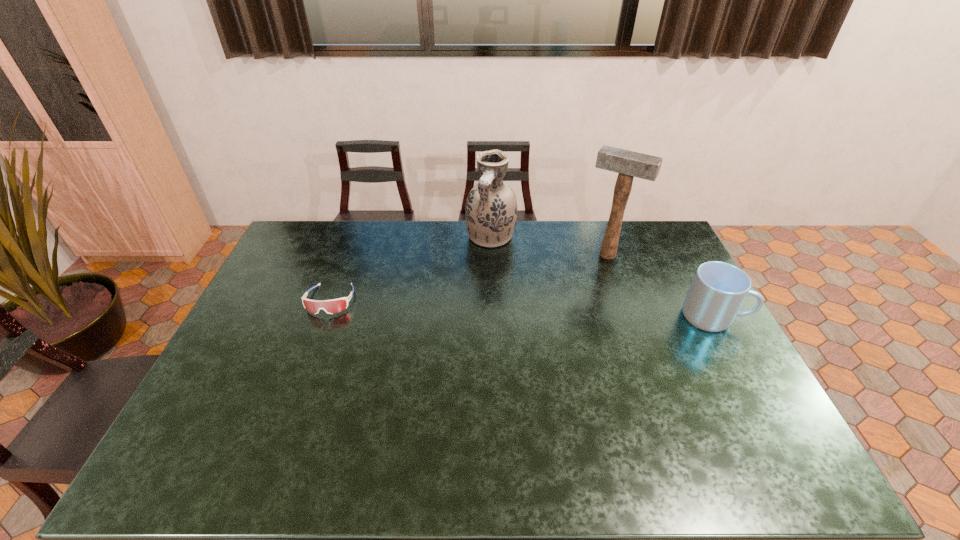
Find the location of a particular element. The height and width of the screenshot is (540, 960). the shortest object is located at coordinates [333, 306].

The image size is (960, 540). In order to click on goggles in this screenshot , I will do `click(333, 306)`.

In order to click on mug in this screenshot , I will do `click(718, 289)`.

Where is `the rightmost object`? the rightmost object is located at coordinates (718, 289).

Locate an element on the screen. This screenshot has height=540, width=960. mallet is located at coordinates click(628, 164).

At what (x,y) coordinates should I click in order to perform the action: click on the third shortest object. Please return your answer as a coordinate pair (x, y). This screenshot has height=540, width=960. Looking at the image, I should click on (491, 210).

The image size is (960, 540). Find the location of `the third object from right to left`. the third object from right to left is located at coordinates (491, 210).

This screenshot has height=540, width=960. I want to click on free space located on the front-facing side of the goggles, so click(298, 388).

Find the location of a particular element. vacant space located 0.070m on the left of the rightmost object is located at coordinates (660, 316).

Locate an element on the screen. free space located 0.290m on the striking surface of the mallet is located at coordinates (568, 316).